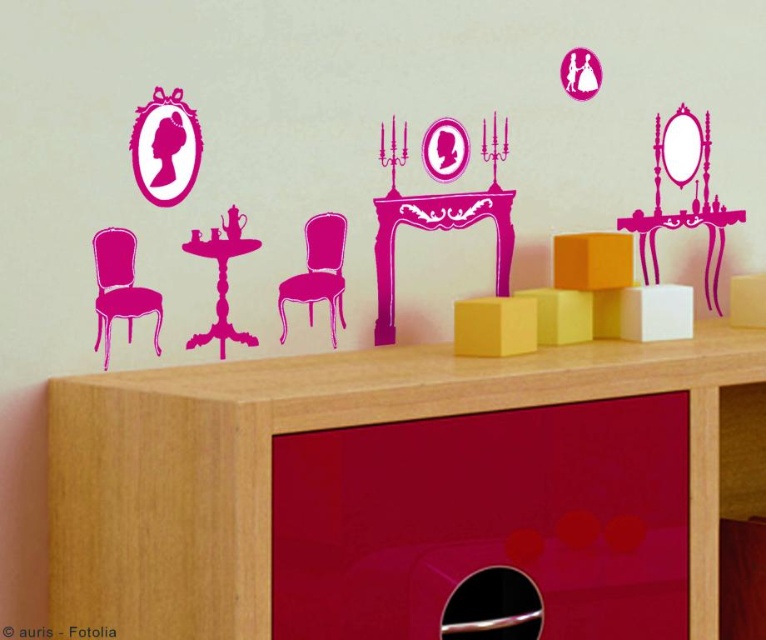
You are standing in front of the cabinet with the glossy red drawer and light wood finish. You notice two points marked on the wall with vintage furniture silhouettes. The first point is at coordinates point(336, 276) and the second at point(247, 339). From your perspective, which point is closer to you?

Point(247, 339) is closer to you because it is in front of point(336, 276) according to their spatial arrangement.

You are standing in front of the wall with the pink silhouette decals and need to place a small vase on the wooden dresser at lower center. However, there is a pink glossy chair at center in the way. Can you move the vase to the dresser without moving the chair?

The wooden dresser at lower center is closer to the viewer than the pink glossy chair at center, so you can reach the dresser without moving the chair because it is in front of the chair.